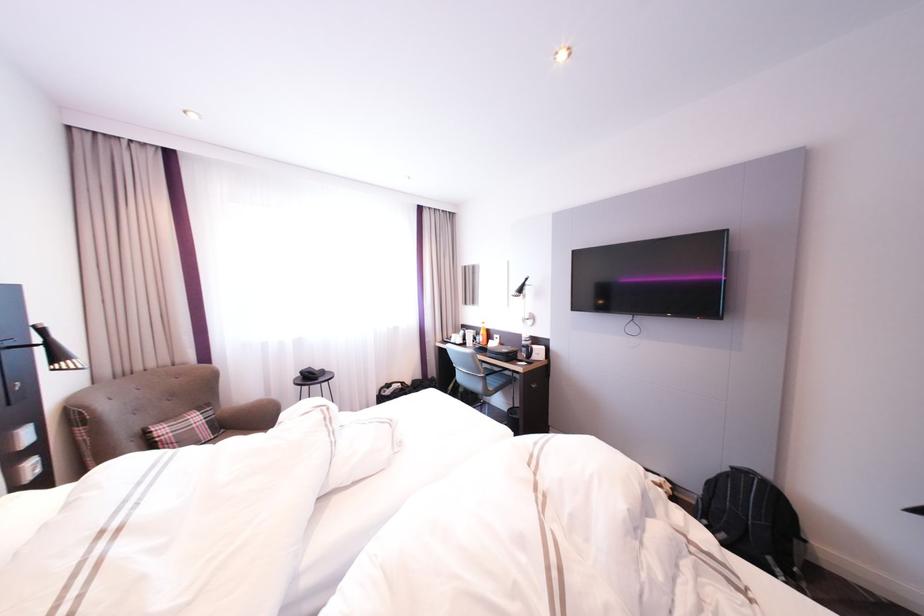
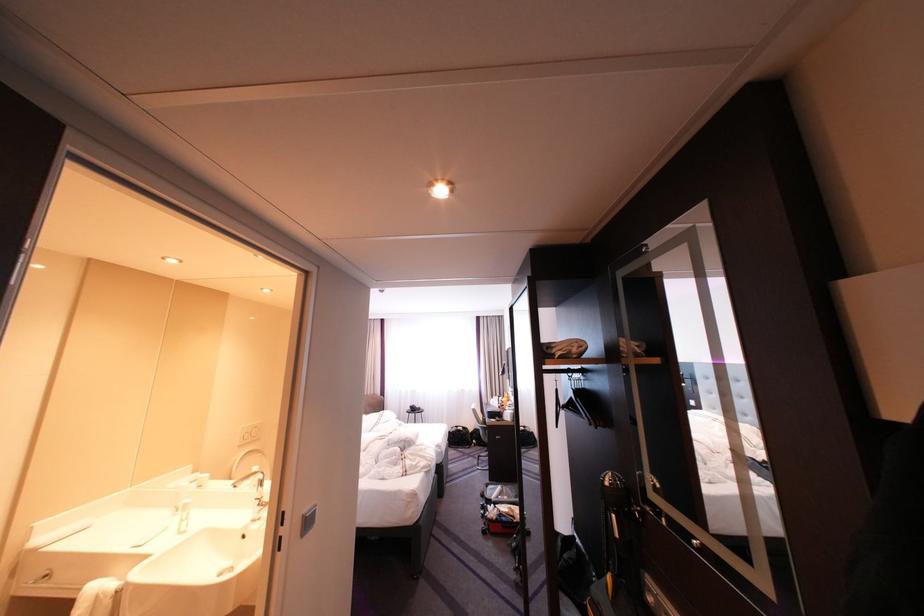
In the second image, find the point that corresponds to the point at 405,392 in the first image.

(467, 431)